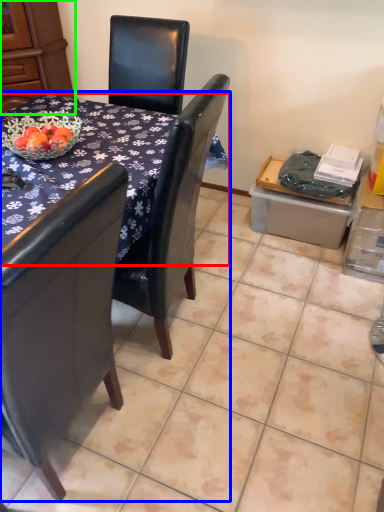
Question: Which object is positioned closest to desk (highlighted by a red box)? Select from table (highlighted by a blue box) and armoire (highlighted by a green box).

Choices:
 (A) table
 (B) armoire

Answer: (A)